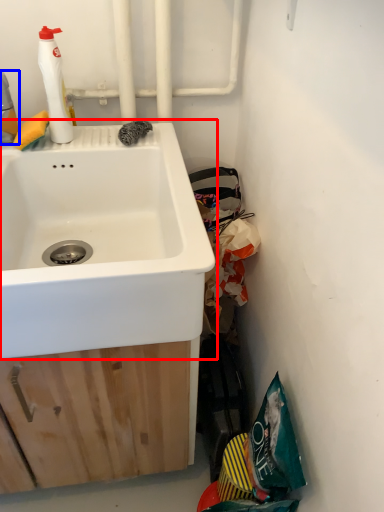
Question: Which point is further to the camera, sink (highlighted by a red box) or cleaning product (highlighted by a blue box)?

Choices:
 (A) sink
 (B) cleaning product

Answer: (B)